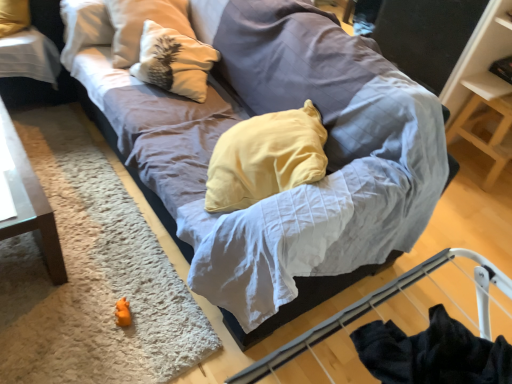
Question: Looking at their shapes, would you say black glossy table at upper left is wider or thinner than textured gray couch at center?

Choices:
 (A) thin
 (B) wide

Answer: (A)

Question: From their relative heights in the image, would you say black glossy table at upper left is taller or shorter than textured gray couch at center?

Choices:
 (A) short
 (B) tall

Answer: (A)

Question: Which object is the farthest from the wooden shelf at upper right?

Choices:
 (A) textured gray couch at center
 (B) white shaggy rug at lower left
 (C) black glossy table at upper left
 (D) white textured pillow at upper left
 (E) orange plush toy at lower left

Answer: (C)

Question: Based on their relative distances, which object is farther from the orange plush toy at lower left?

Choices:
 (A) black glossy table at upper left
 (B) wooden shelf at upper right
 (C) textured gray couch at center
 (D) white textured pillow at upper left
 (E) white shaggy rug at lower left

Answer: (B)